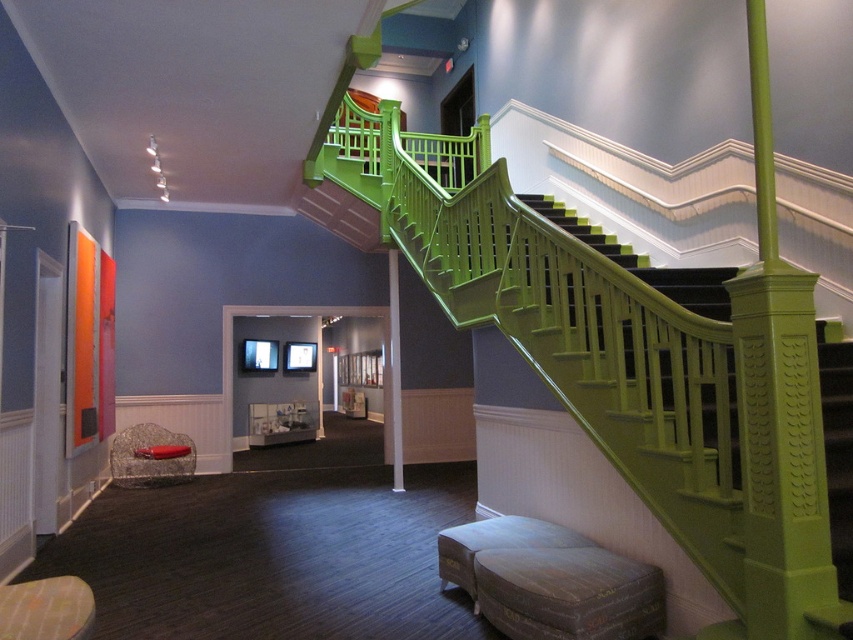
Consider the image. You are a guest entering the room and want to sit down. You see the distressed brown leather stool at lower center and the velvet grey ottoman at lower center. Which one is more suitable for placing your bag on top?

The velvet grey ottoman at lower center is more suitable for placing your bag on top because it has a larger size compared to the distressed brown leather stool at lower center.

You are moving a 50 cm wide painting from the wall to the floor. You want to place it between the distressed brown leather stool at lower center and the velvet grey ottoman at lower center. Will there be enough space for the painting to fit between them?

The distance between the distressed brown leather stool at lower center and the velvet grey ottoman at lower center is 44.92 centimeters. Since the painting is 50 cm wide, it will not fit between them as the space is narrower than the painting.

You are standing at the camera position in the image. There is a distressed brown leather stool at lower center that you want to reach. Can you walk directly to it without needing to move any furniture?

The distressed brown leather stool at lower center and camera are 2.96 meters apart. Since there is no mention of furniture obstructing the path, you can walk directly to it.